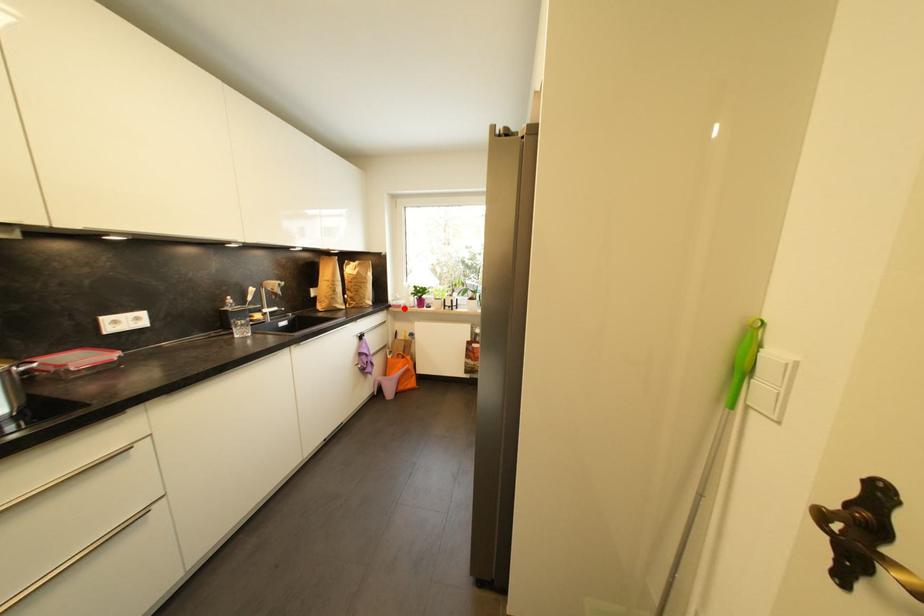
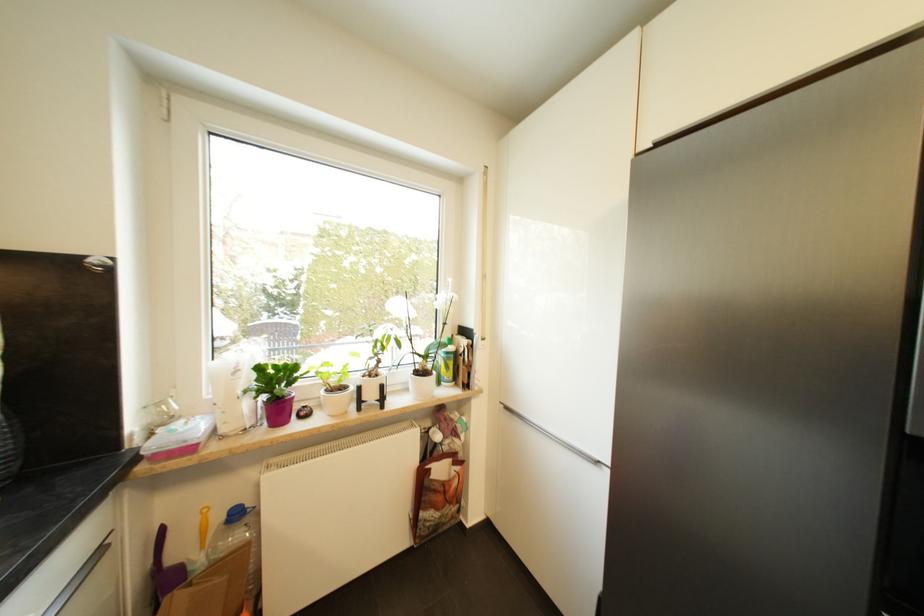
Where in the second image is the point corresponding to the highlighted location from the first image?

(195, 451)